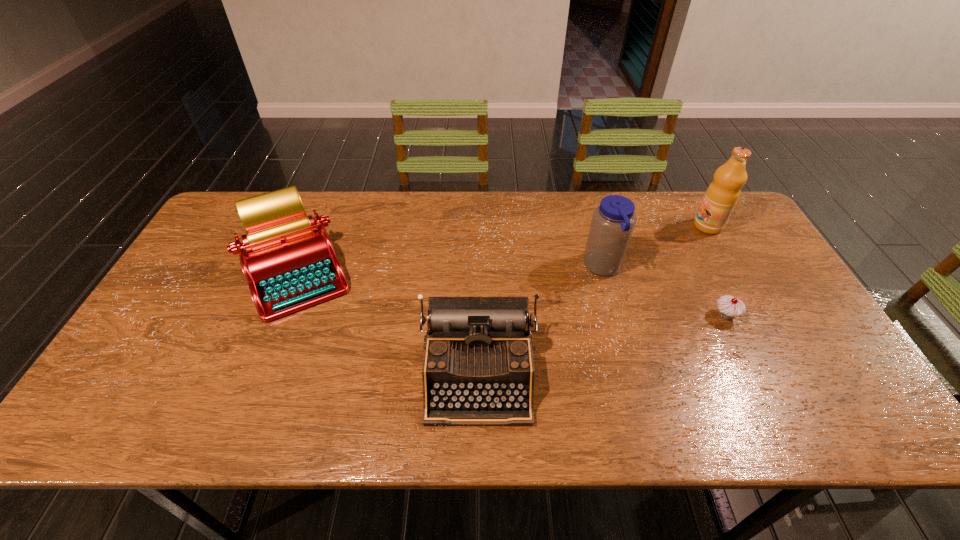
Locate an element on the screen. This screenshot has width=960, height=540. the tallest object is located at coordinates (721, 196).

This screenshot has width=960, height=540. Find the location of `fruit juice`. fruit juice is located at coordinates (721, 196).

In order to click on the third object from right to left in this screenshot , I will do `click(613, 221)`.

Locate an element on the screen. This screenshot has width=960, height=540. water bottle is located at coordinates (613, 221).

This screenshot has width=960, height=540. I want to click on the farther typewriter, so click(289, 265).

Find the location of a particular element. The height and width of the screenshot is (540, 960). the left typewriter is located at coordinates (289, 265).

You are a GUI agent. You are given a task and a screenshot of the screen. Output one action in this format:
    pyautogui.click(x=<x>, y=<y>)
    Task: Click on the right typewriter
    The image size is (960, 540).
    Given the screenshot: What is the action you would take?
    478,368

Where is `the nearest object`? The image size is (960, 540). the nearest object is located at coordinates (478, 368).

Identify the location of the fourth object from left to right. (729, 307).

At what (x,y) coordinates should I click in order to perform the action: click on the shortest object. Please return your answer as a coordinate pair (x, y). Looking at the image, I should click on (729, 307).